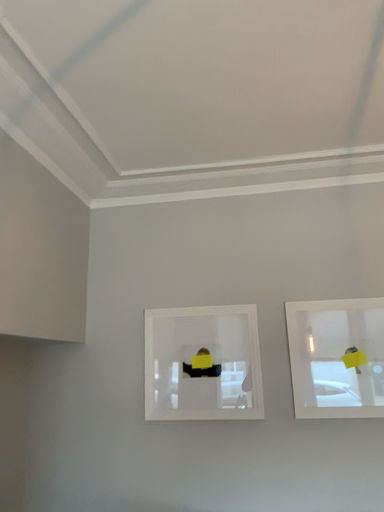
Question: In the image, is clear plastic picture frame at center, marked as the first picture frame in a left-to-right arrangement, positioned in front of or behind clear glass picture frame at upper right, the first picture frame from the right?

Choices:
 (A) front
 (B) behind

Answer: (B)

Question: Is clear plastic picture frame at center, marked as the first picture frame in a left-to-right arrangement, wider or thinner than clear glass picture frame at upper right, the first picture frame from the right?

Choices:
 (A) wide
 (B) thin

Answer: (B)

Question: From the image's perspective, is clear plastic picture frame at center, marked as the first picture frame in a left-to-right arrangement, above or below clear glass picture frame at upper right, the first picture frame from the right?

Choices:
 (A) below
 (B) above

Answer: (A)

Question: Based on their sizes in the image, would you say clear glass picture frame at upper right, the first picture frame from the right, is bigger or smaller than clear plastic picture frame at center, the 2th picture frame positioned from the right?

Choices:
 (A) big
 (B) small

Answer: (B)

Question: Would you say clear glass picture frame at upper right, placed as the 2th picture frame when sorted from left to right, is inside or outside clear plastic picture frame at center, marked as the first picture frame in a left-to-right arrangement?

Choices:
 (A) inside
 (B) outside

Answer: (B)

Question: Looking at their shapes, would you say clear glass picture frame at upper right, placed as the 2th picture frame when sorted from left to right, is wider or thinner than clear plastic picture frame at center, the 2th picture frame positioned from the right?

Choices:
 (A) thin
 (B) wide

Answer: (B)

Question: Is clear glass picture frame at upper right, placed as the 2th picture frame when sorted from left to right, in front of or behind clear plastic picture frame at center, the 2th picture frame positioned from the right, in the image?

Choices:
 (A) front
 (B) behind

Answer: (A)